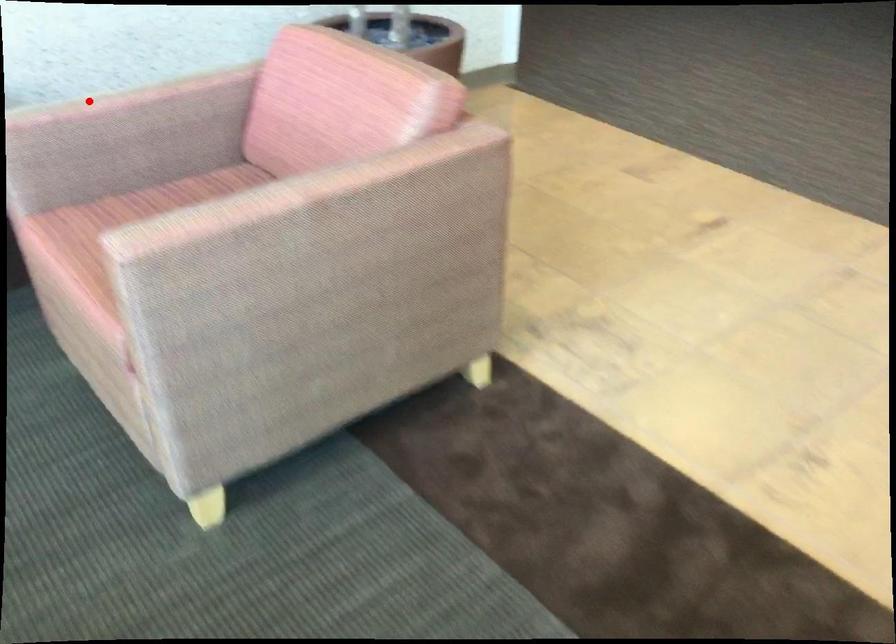
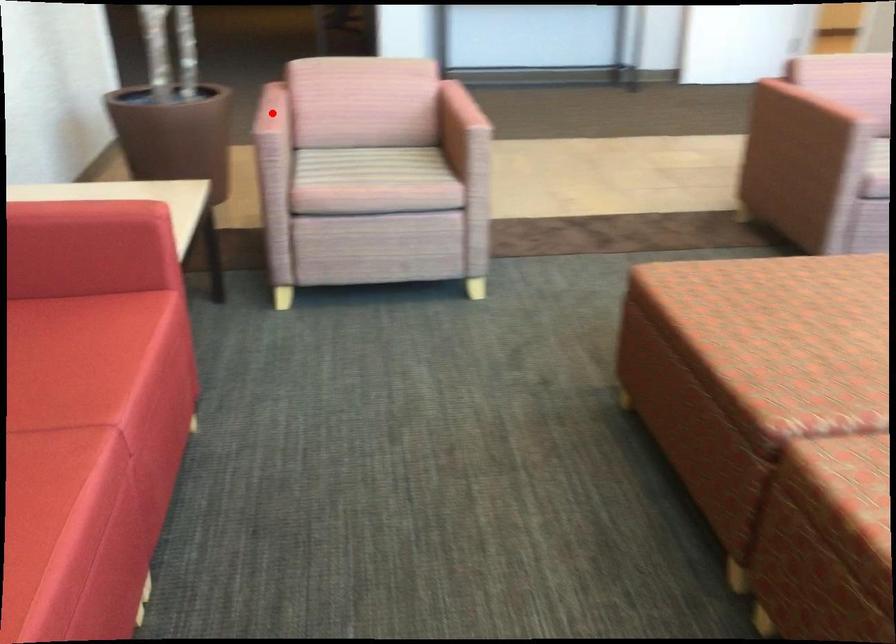
I am providing you with two images of the same scene from different viewpoints. A red point is marked on the first image and another point is marked on the second image. Are the points marked in image1 and image2 representing the same 3D position?

Yes